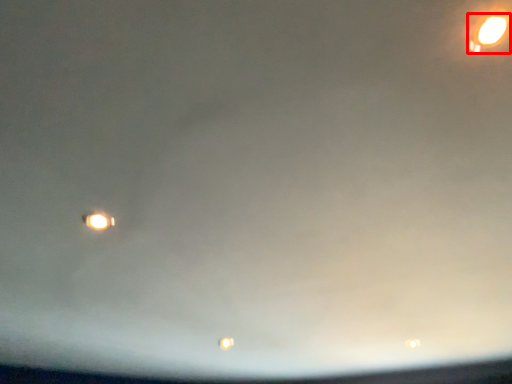
Question: From the image's perspective, what is the correct spatial relationship of street light (annotated by the red box) in relation to street light?

Choices:
 (A) above
 (B) below

Answer: (A)